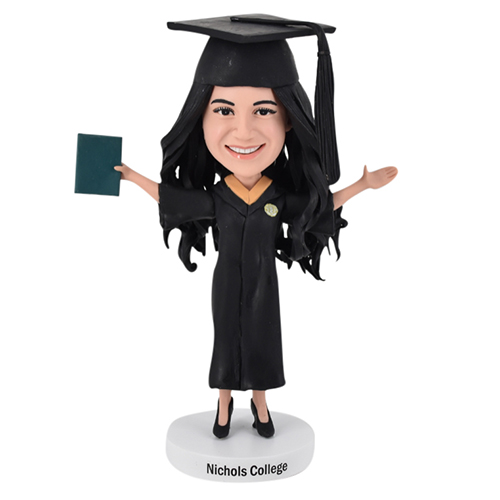
Where is `tassel`? tassel is located at coordinates (329, 89).